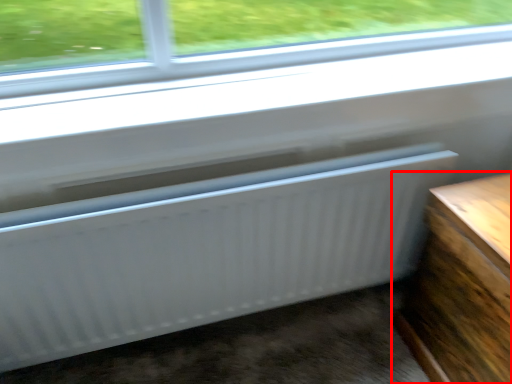
Question: Observing the image, what is the correct spatial positioning of furniture (annotated by the red box) in reference to radiator?

Choices:
 (A) right
 (B) left

Answer: (A)